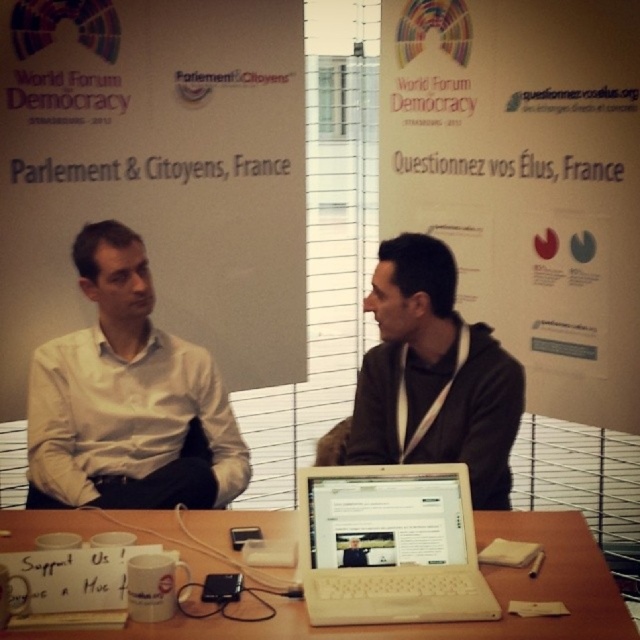
Can you confirm if white paper at upper center is shorter than white paper at center?

Yes, white paper at upper center is shorter than white paper at center.

Measure the distance between white paper at upper center and camera.

They are 2.54 meters apart.

Locate an element on the screen. white paper at upper center is located at coordinates (156, 172).

Does matte black hoodie at center appear on the right side of white plastic laptop at center?

Yes, matte black hoodie at center is to the right of white plastic laptop at center.

Is matte black hoodie at center below white plastic laptop at center?

No.

Is point (502, 384) less distant than point (442, 508)?

No, (502, 384) is behind (442, 508).

What are the coordinates of `matte black hoodie at center` in the screenshot? It's located at (433, 376).

Does white paper at center have a greater width compared to white matte coffee cup at lower center?

Yes.

In the scene shown: Is white paper at center bigger than white matte coffee cup at lower center?

Yes.

What do you see at coordinates (525, 180) in the screenshot? I see `white paper at center` at bounding box center [525, 180].

You are a GUI agent. You are given a task and a screenshot of the screen. Output one action in this format:
    pyautogui.click(x=<x>, y=<y>)
    Task: Click on the white paper at center
    
    Given the screenshot: What is the action you would take?
    pyautogui.click(x=525, y=180)